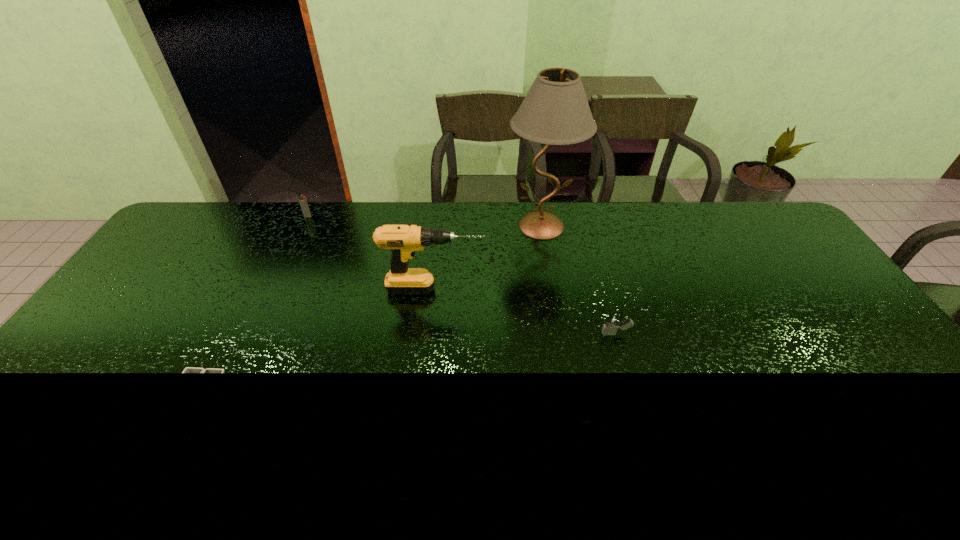
The height and width of the screenshot is (540, 960). Identify the location of free space between the nearest object and the table lamp. (371, 309).

Find the location of a particular element. This screenshot has height=540, width=960. free space between the third farthest object and the nearest object is located at coordinates (317, 341).

Where is `vacant space that is in between the table lamp and the shortest object`? The width and height of the screenshot is (960, 540). vacant space that is in between the table lamp and the shortest object is located at coordinates (371, 309).

The height and width of the screenshot is (540, 960). I want to click on empty location between the table lamp and the left igniter, so click(424, 221).

Find the location of a particular element. free space between the right igniter and the third farthest object is located at coordinates (525, 312).

This screenshot has height=540, width=960. What are the coordinates of `vacant area that lies between the table lamp and the ashtray` in the screenshot? It's located at (371, 309).

The image size is (960, 540). I want to click on empty space between the ashtray and the farther igniter, so click(253, 304).

You are a GUI agent. You are given a task and a screenshot of the screen. Output one action in this format:
    pyautogui.click(x=<x>, y=<y>)
    Task: Click on the free area in between the tallest object and the drill
    This screenshot has width=960, height=540.
    Given the screenshot: What is the action you would take?
    pyautogui.click(x=488, y=258)

At what (x,y) coordinates should I click in order to perform the action: click on unoccupied area between the farther igniter and the tallest object. Please return your answer as a coordinate pair (x, y). This screenshot has width=960, height=540. Looking at the image, I should click on (424, 221).

In order to click on free area in between the second tallest object and the nearest object in this screenshot , I will do `click(317, 341)`.